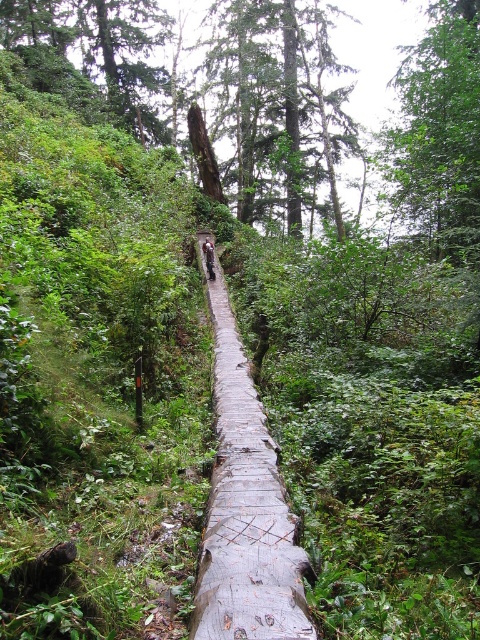
Question: Among these objects, which one is farthest from the camera?

Choices:
 (A) weathered wood bridge at center
 (B) green rough bark tree at upper center
 (C) camouflage jacket at center
 (D) green leafy tree at upper center

Answer: (B)

Question: Which object is closer to the camera taking this photo?

Choices:
 (A) weathered wood bridge at center
 (B) green leafy tree at upper center
 (C) camouflage jacket at center

Answer: (A)

Question: Based on their relative distances, which object is nearer to the green rough bark tree at upper center?

Choices:
 (A) camouflage jacket at center
 (B) green leafy tree at upper center
 (C) weathered wood bridge at center

Answer: (B)

Question: Can you confirm if green rough bark tree at upper center is smaller than camouflage jacket at center?

Choices:
 (A) yes
 (B) no

Answer: (B)

Question: Is green rough bark tree at upper center to the left of green leafy tree at upper center from the viewer's perspective?

Choices:
 (A) no
 (B) yes

Answer: (B)

Question: Is green rough bark tree at upper center below green leafy tree at upper center?

Choices:
 (A) no
 (B) yes

Answer: (A)